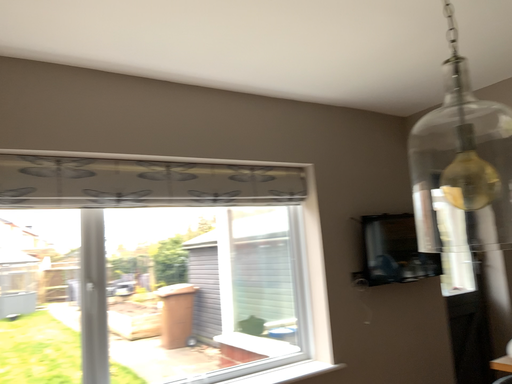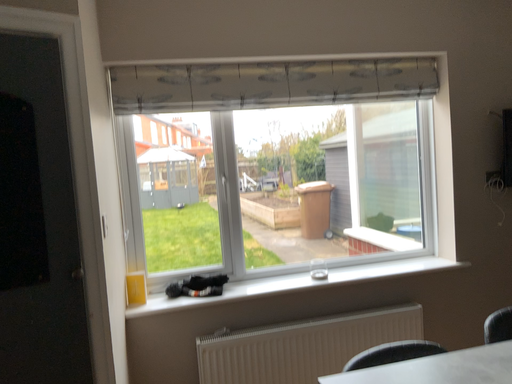
Question: How did the camera likely rotate when shooting the video?

Choices:
 (A) rotated left
 (B) rotated right

Answer: (A)